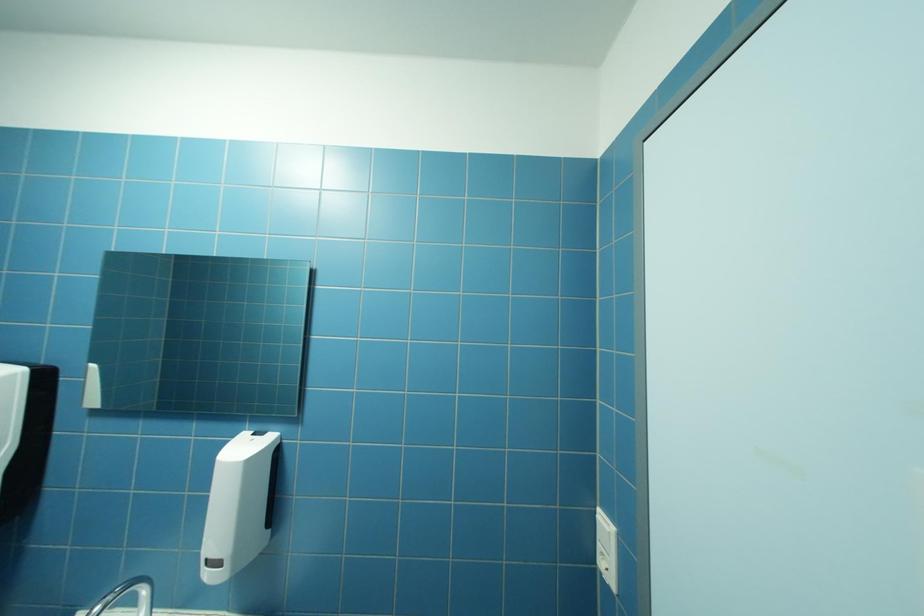
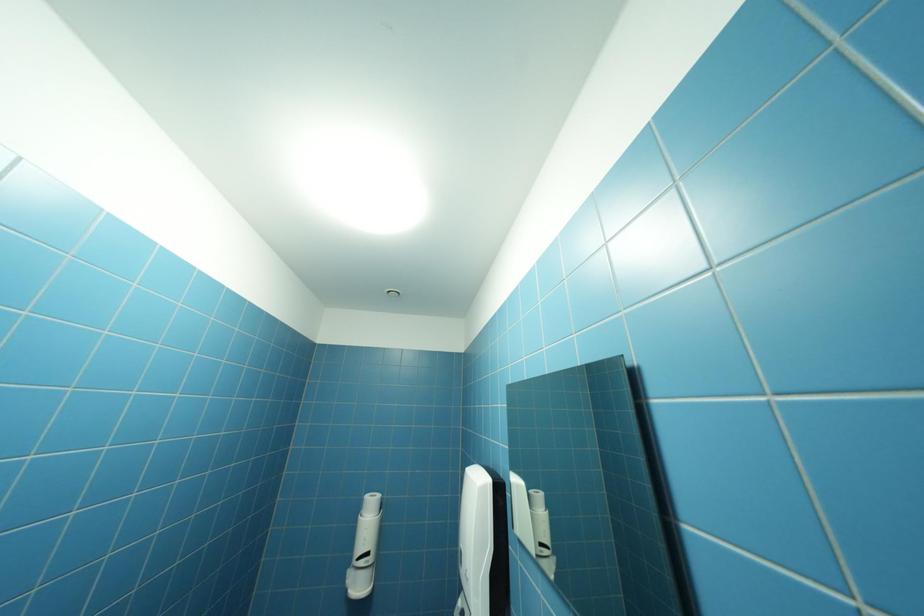
Consider the image. Based on the continuous images, in which direction is the camera rotating?

The camera rotated toward left-up.